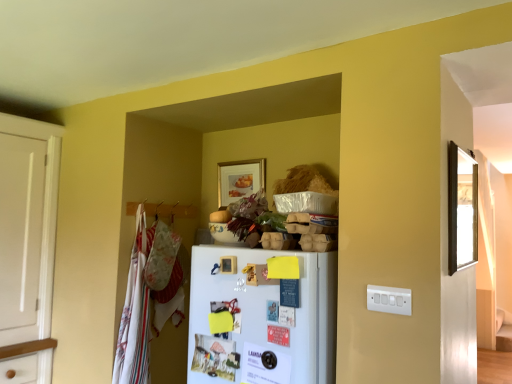
Question: From the image's perspective, is white plastic switch plate at lower right on white cotton laundry at left?

Choices:
 (A) no
 (B) yes

Answer: (B)

Question: Can you confirm if white plastic switch plate at lower right is positioned to the right of white cotton laundry at left?

Choices:
 (A) no
 (B) yes

Answer: (B)

Question: Does white plastic switch plate at lower right have a lesser width compared to white cotton laundry at left?

Choices:
 (A) no
 (B) yes

Answer: (B)

Question: Does white plastic switch plate at lower right lie in front of white cotton laundry at left?

Choices:
 (A) no
 (B) yes

Answer: (B)

Question: From the image's perspective, is white plastic switch plate at lower right below white cotton laundry at left?

Choices:
 (A) no
 (B) yes

Answer: (A)

Question: Is white plastic switch plate at lower right positioned far away from white cotton laundry at left?

Choices:
 (A) yes
 (B) no

Answer: (A)

Question: Considering the relative sizes of wooden mirror at right, marked as the 2th picture frame in a back-to-front arrangement, and white plastic switch plate at lower right in the image provided, is wooden mirror at right, marked as the 2th picture frame in a back-to-front arrangement, thinner than white plastic switch plate at lower right?

Choices:
 (A) no
 (B) yes

Answer: (A)

Question: From a real-world perspective, is wooden mirror at right, the 1th picture frame viewed from the right, located beneath white plastic switch plate at lower right?

Choices:
 (A) no
 (B) yes

Answer: (A)

Question: Is wooden mirror at right, marked as the 2th picture frame in a back-to-front arrangement, looking in the opposite direction of white plastic switch plate at lower right?

Choices:
 (A) yes
 (B) no

Answer: (B)

Question: Would you say wooden mirror at right, placed as the first picture frame when sorted from front to back, contains white plastic switch plate at lower right?

Choices:
 (A) no
 (B) yes

Answer: (A)

Question: Can you confirm if wooden mirror at right, positioned as the 2th picture frame in left-to-right order, is shorter than white plastic switch plate at lower right?

Choices:
 (A) yes
 (B) no

Answer: (B)

Question: Is wooden mirror at right, marked as the 2th picture frame in a back-to-front arrangement, aimed at white plastic switch plate at lower right?

Choices:
 (A) no
 (B) yes

Answer: (A)

Question: Can you confirm if white matte refrigerator at center is positioned to the left of white cotton laundry at left?

Choices:
 (A) yes
 (B) no

Answer: (B)